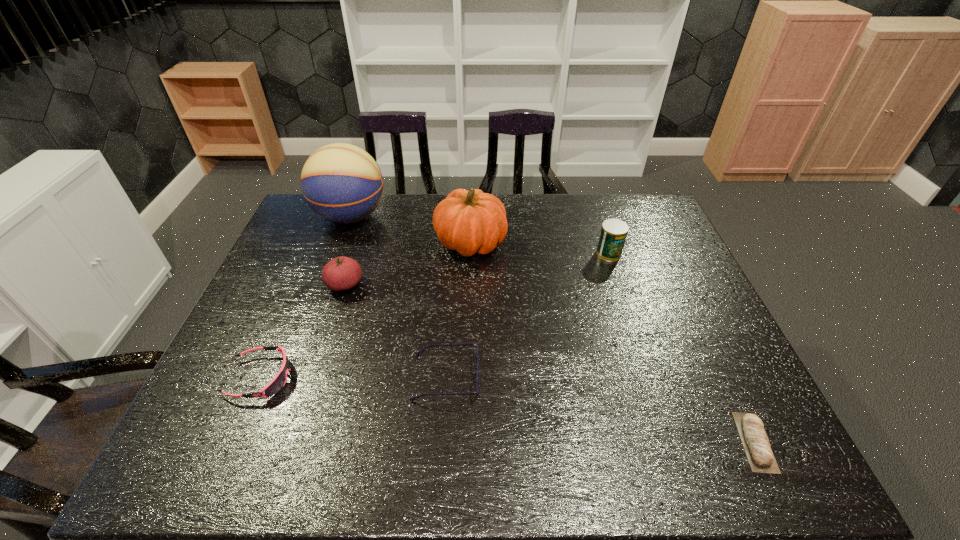
Locate an element on the screen. This screenshot has width=960, height=540. vacant region located 0.100m on the left of the second object from right to left is located at coordinates (564, 253).

The width and height of the screenshot is (960, 540). Identify the location of vacant area situated on the front of the fourth farthest object. (324, 353).

You are a GUI agent. You are given a task and a screenshot of the screen. Output one action in this format:
    pyautogui.click(x=<x>, y=<y>)
    Task: Click on the free space located 0.190m on the front-facing side of the spectacles
    
    Given the screenshot: What is the action you would take?
    pyautogui.click(x=559, y=378)

Where is `vacant point located on the front-facing side of the goggles`? This screenshot has width=960, height=540. vacant point located on the front-facing side of the goggles is located at coordinates (437, 377).

Find the location of a particular element. The width and height of the screenshot is (960, 540). free space located on the left of the pita bread is located at coordinates (659, 442).

Identify the location of basketball located at the far edge. This screenshot has height=540, width=960. (342, 183).

Locate an element on the screen. Image resolution: width=960 pixels, height=540 pixels. pumpkin situated at the far edge is located at coordinates (470, 222).

Image resolution: width=960 pixels, height=540 pixels. I want to click on object that is at the near edge, so click(756, 444).

Identify the location of basketball located at the left edge. (342, 183).

Identify the location of goggles that is at the left edge. (277, 383).